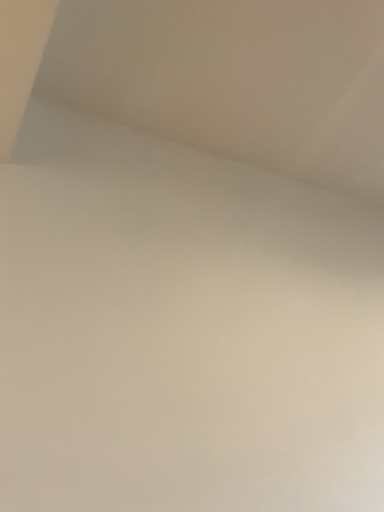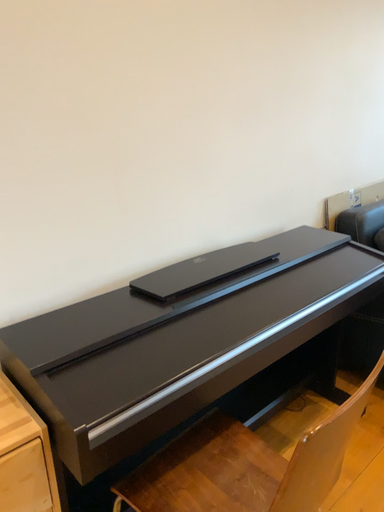
Question: Which way did the camera rotate in the video?

Choices:
 (A) rotated upward
 (B) rotated downward

Answer: (B)